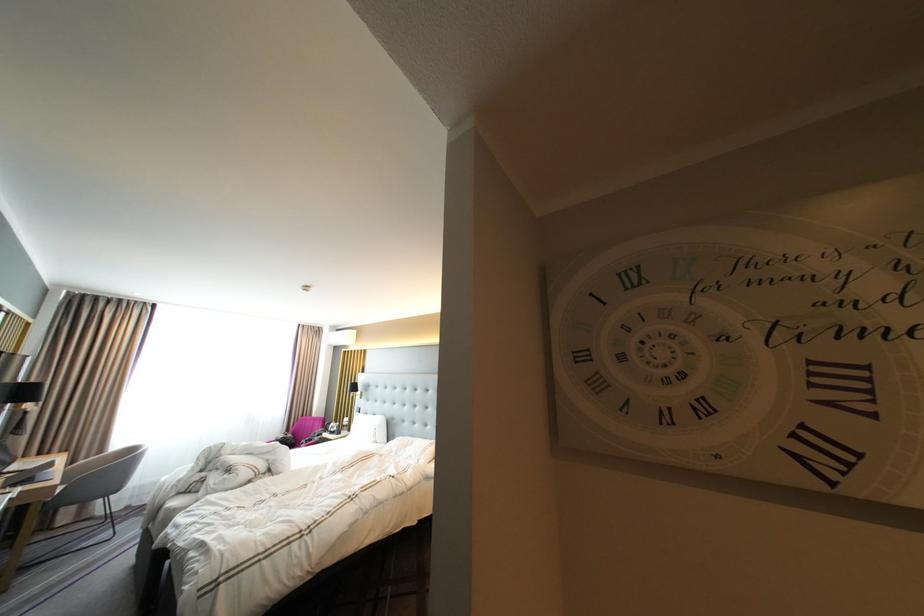
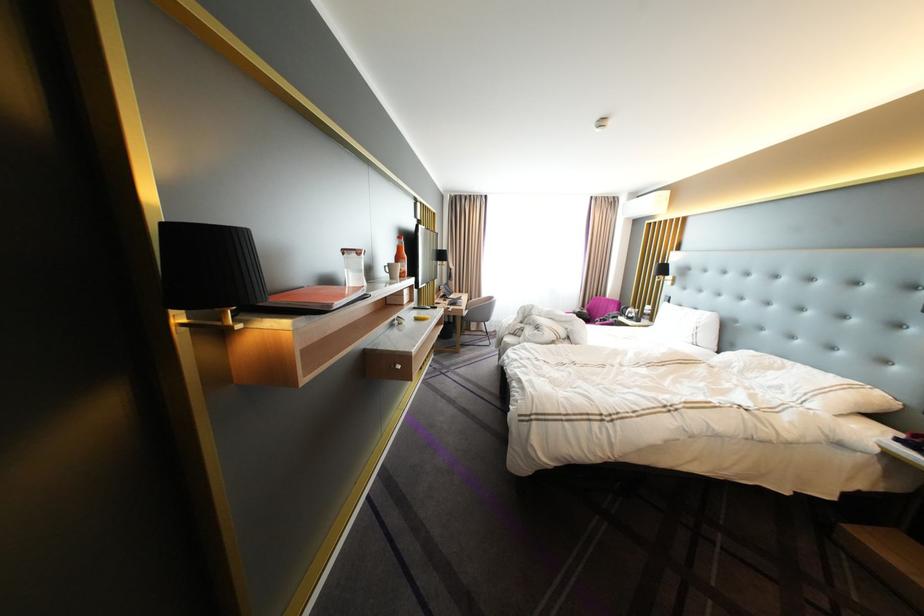
Locate, in the second image, the point that corresponds to (x=294, y=439) in the first image.

(590, 313)